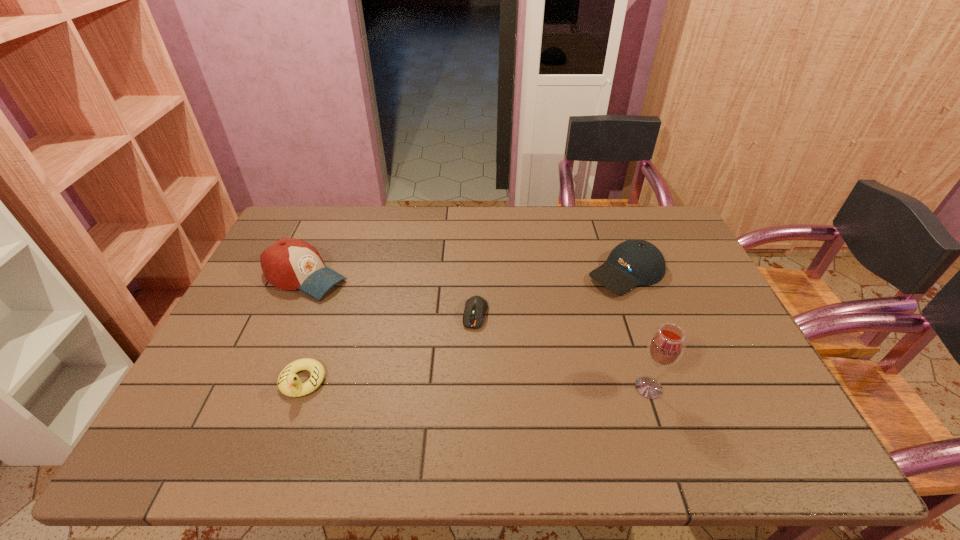
This screenshot has width=960, height=540. In order to click on vacant area that lies between the fourth tallest object and the third shortest object in this screenshot , I will do `click(465, 327)`.

In order to click on free point between the fourth tallest object and the right baseball cap in this screenshot , I will do `click(465, 327)`.

Identify the location of free space that is in between the shorter baseball cap and the shortest object. (551, 293).

What are the coordinates of `vacant point located between the shorter baseball cap and the computer equipment` in the screenshot? It's located at (551, 293).

Find the location of a particular element. This screenshot has height=540, width=960. free space that is in between the taller baseball cap and the wineglass is located at coordinates tap(477, 333).

I want to click on the third closest object relative to the third tallest object, so click(x=289, y=264).

What are the coordinates of `object identified as the third closest to the wineglass` in the screenshot? It's located at (289, 383).

Find the location of `vacant point that satisfies the following two spatial constraints: 1. on the back side of the third shortest object; 2. on the right side of the tallest object`. vacant point that satisfies the following two spatial constraints: 1. on the back side of the third shortest object; 2. on the right side of the tallest object is located at coordinates (611, 273).

The image size is (960, 540). Identify the location of vacant space that satisfies the following two spatial constraints: 1. on the back side of the shorter baseball cap; 2. on the right side of the second tallest object. (307, 273).

At what (x,y) coordinates should I click in order to perform the action: click on blank space that satisfies the following two spatial constraints: 1. on the front side of the tallest object; 2. on the right side of the taller baseball cap. Please return your answer as a coordinate pair (x, y). This screenshot has height=540, width=960. Looking at the image, I should click on (256, 388).